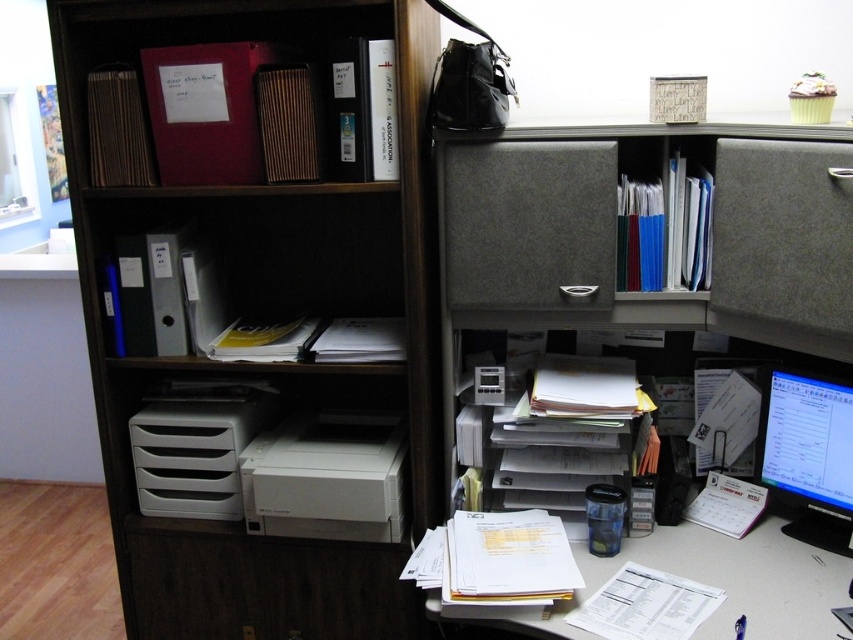
Between wooden bookshelf at left and matte plastic shelves at upper left, which one appears on the left side from the viewer's perspective?

matte plastic shelves at upper left is more to the left.

Which is above, wooden bookshelf at left or matte plastic shelves at upper left?

matte plastic shelves at upper left is higher up.

At what (x,y) coordinates should I click in order to perform the action: click on wooden bookshelf at left. Please return your answer as a coordinate pair (x, y). This screenshot has width=853, height=640. Looking at the image, I should click on (270, 317).

Locate an element on the screen. wooden bookshelf at left is located at coordinates (270, 317).

Does white paper at lower center appear on the right side of matte black monitor at right?

In fact, white paper at lower center is to the left of matte black monitor at right.

Which is in front, point (804, 547) or point (776, 404)?

Point (804, 547) is more forward.

Where is `white paper at lower center`? The height and width of the screenshot is (640, 853). white paper at lower center is located at coordinates (723, 580).

Can you confirm if wooden bookshelf at left is shorter than white paper at lower center?

In fact, wooden bookshelf at left may be taller than white paper at lower center.

Is point (308, 241) farther from viewer compared to point (647, 538)?

Yes, it is.

Locate an element on the screen. The image size is (853, 640). wooden bookshelf at left is located at coordinates (270, 317).